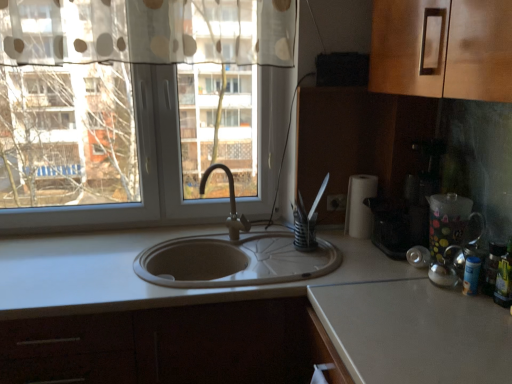
I want to click on vacant region to the left of white paper towel at right, so click(331, 240).